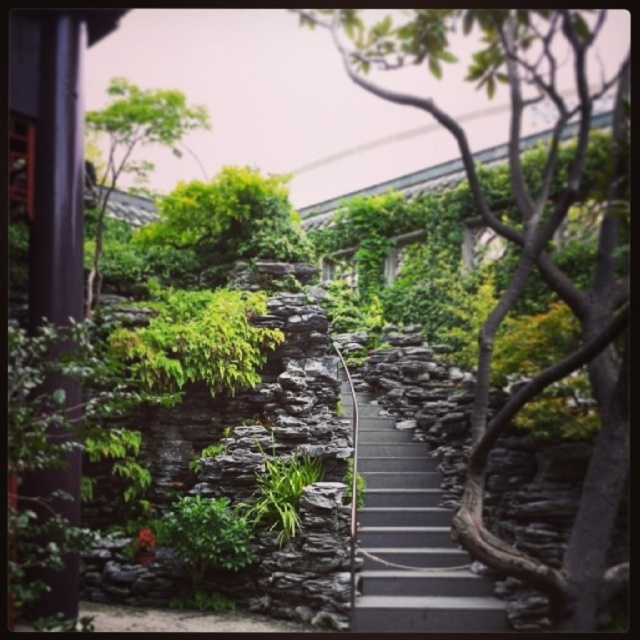
Based on the photo, can you confirm if dark gray stone stairs at center is wider than green leafy tree at upper left?

A: In fact, dark gray stone stairs at center might be narrower than green leafy tree at upper left.

Between point (388, 572) and point (166, 132), which one is positioned in front?

Point (388, 572) is more forward.

This screenshot has height=640, width=640. Identify the location of dark gray stone stairs at center. (408, 536).

Where is `dark gray stone stairs at center`? dark gray stone stairs at center is located at coordinates click(408, 536).

This screenshot has width=640, height=640. I want to click on green leafy tree at center, so click(x=529, y=269).

Image resolution: width=640 pixels, height=640 pixels. Describe the element at coordinates (529, 269) in the screenshot. I see `green leafy tree at center` at that location.

Based on the photo, who is more forward, (608, 444) or (384, 452)?

Positioned in front is point (608, 444).

Identify the location of green leafy tree at center. (529, 269).

In the scene shown: Between green leafy tree at center and green leafy tree at upper left, which one is positioned higher?

green leafy tree at center

Locate an element on the screen. Image resolution: width=640 pixels, height=640 pixels. green leafy tree at center is located at coordinates (529, 269).